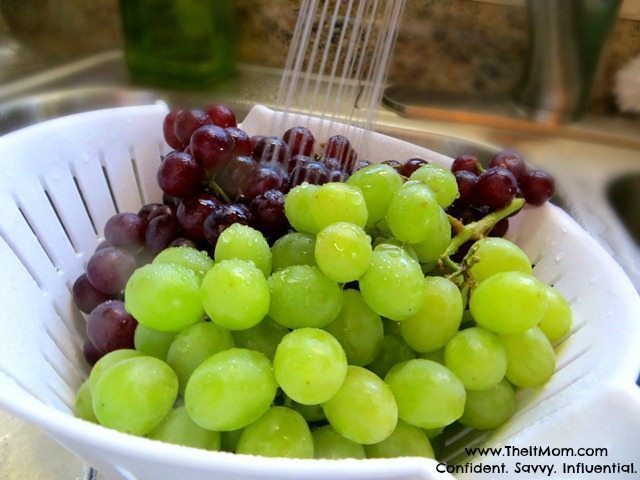
The height and width of the screenshot is (480, 640). I want to click on counter top, so click(x=29, y=458).